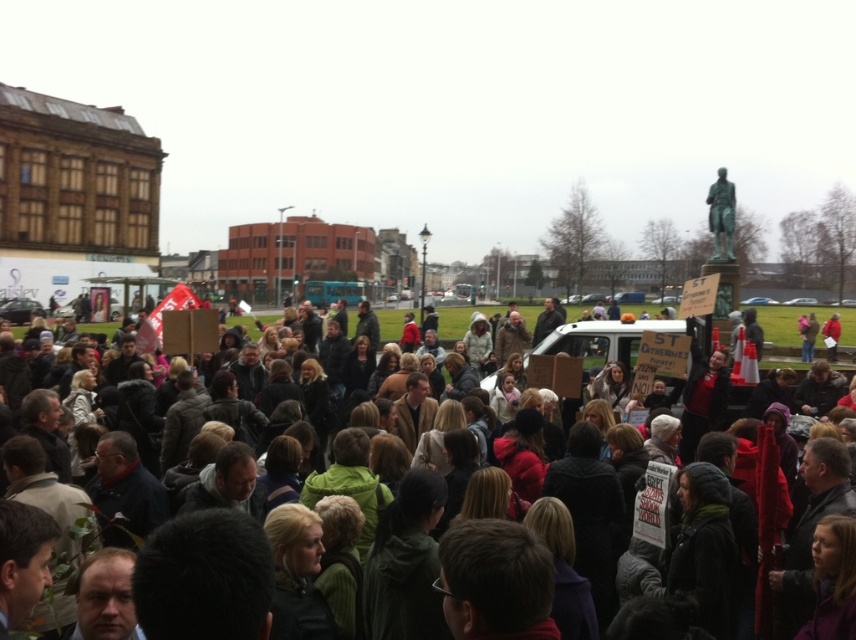
Question: Which object appears closest to the camera in this image?

Choices:
 (A) green polished statue at upper right
 (B) dark gray clothing at center

Answer: (B)

Question: Does dark gray clothing at center come in front of green polished statue at upper right?

Choices:
 (A) no
 (B) yes

Answer: (B)

Question: In this image, where is dark gray clothing at center located relative to green polished statue at upper right?

Choices:
 (A) left
 (B) right

Answer: (A)

Question: Which point is closer to the camera?

Choices:
 (A) green polished statue at upper right
 (B) dark gray clothing at center

Answer: (B)

Question: Can you confirm if dark gray clothing at center is positioned to the left of green polished statue at upper right?

Choices:
 (A) no
 (B) yes

Answer: (B)